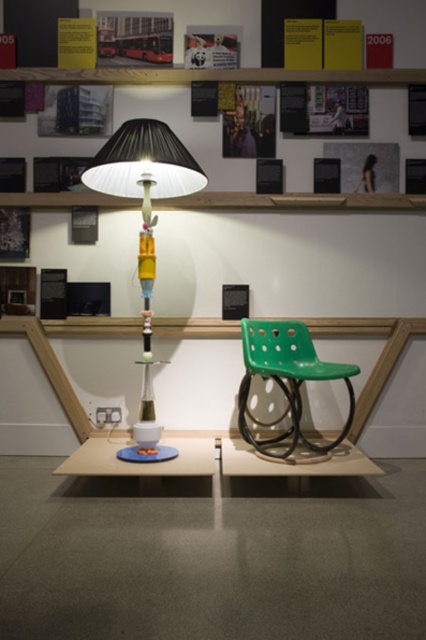
Question: Which point appears farthest from the camera in this image?

Choices:
 (A) (158, 429)
 (B) (374, 125)
 (C) (63, 464)
 (D) (293, 356)

Answer: (B)

Question: Does matte black lampshade at upper center lie behind matte white table at center?

Choices:
 (A) yes
 (B) no

Answer: (A)

Question: Based on their relative distances, which object is farther from the green plastic chair at center?

Choices:
 (A) matte black lampshade at center
 (B) matte black lampshade at upper center

Answer: (B)

Question: Does green plastic chair at center appear under matte white table at center?

Choices:
 (A) yes
 (B) no

Answer: (B)

Question: Among these points, which one is nearest to the camera?

Choices:
 (A) click(290, 394)
 (B) click(103, 451)

Answer: (A)

Question: Does matte black lampshade at center have a lesser width compared to matte white table at center?

Choices:
 (A) yes
 (B) no

Answer: (A)